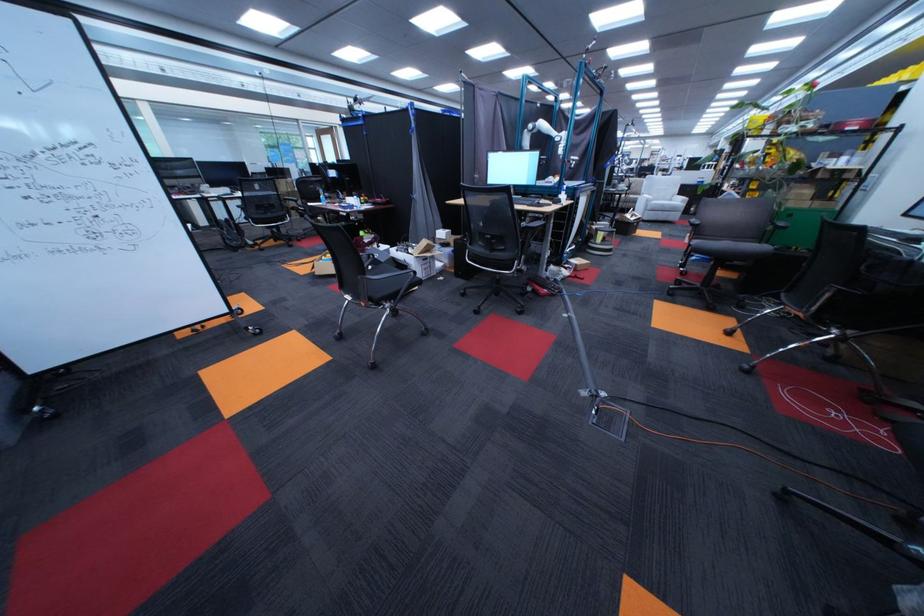
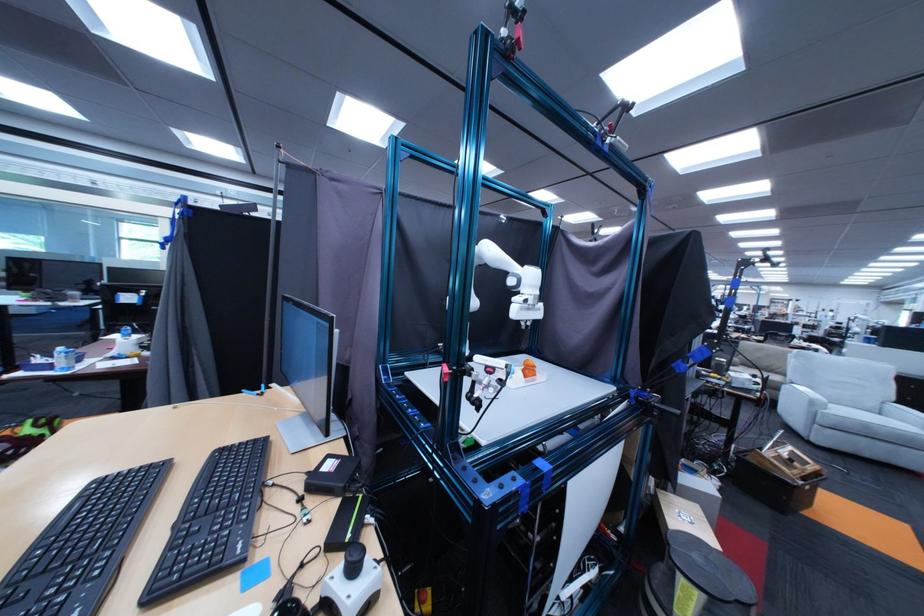
In the second image, find the point that corresponds to point 675,206 in the first image.

(879, 426)